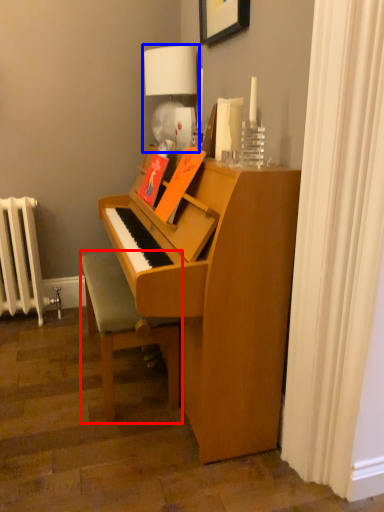
Question: Among these objects, which one is farthest to the camera, furniture (highlighted by a red box) or table lamp (highlighted by a blue box)?

Choices:
 (A) furniture
 (B) table lamp

Answer: (B)